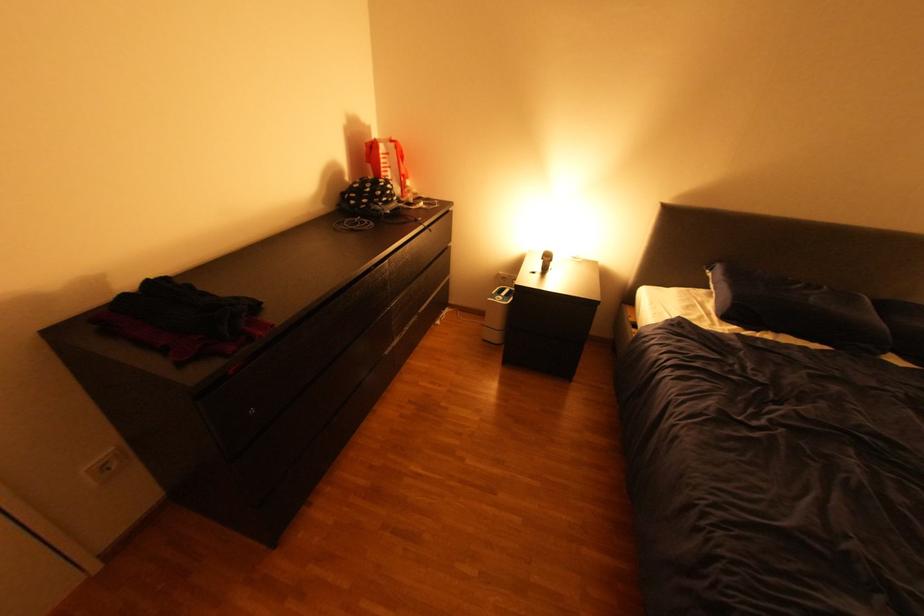
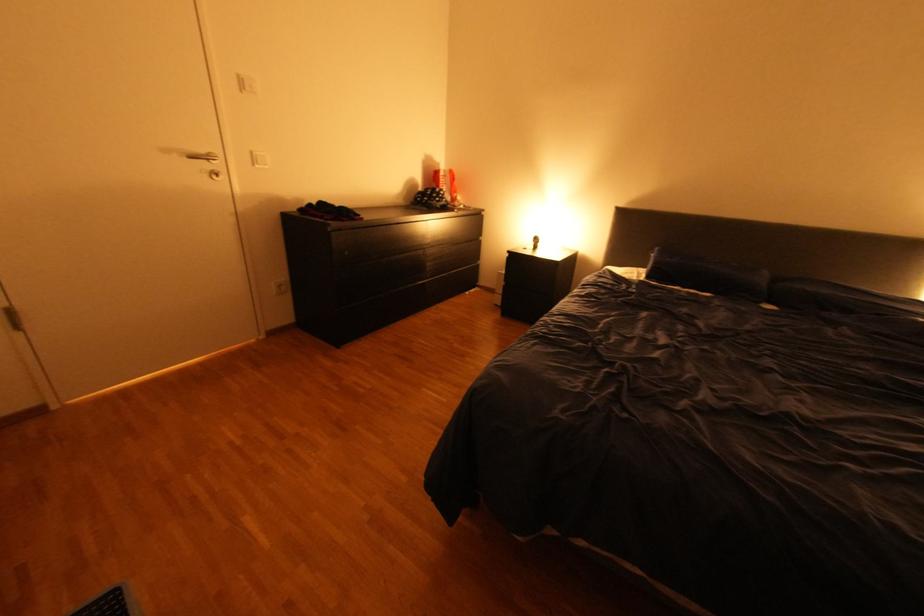
In the second image, find the point that corresponds to pixel 718 315 in the first image.

(648, 277)